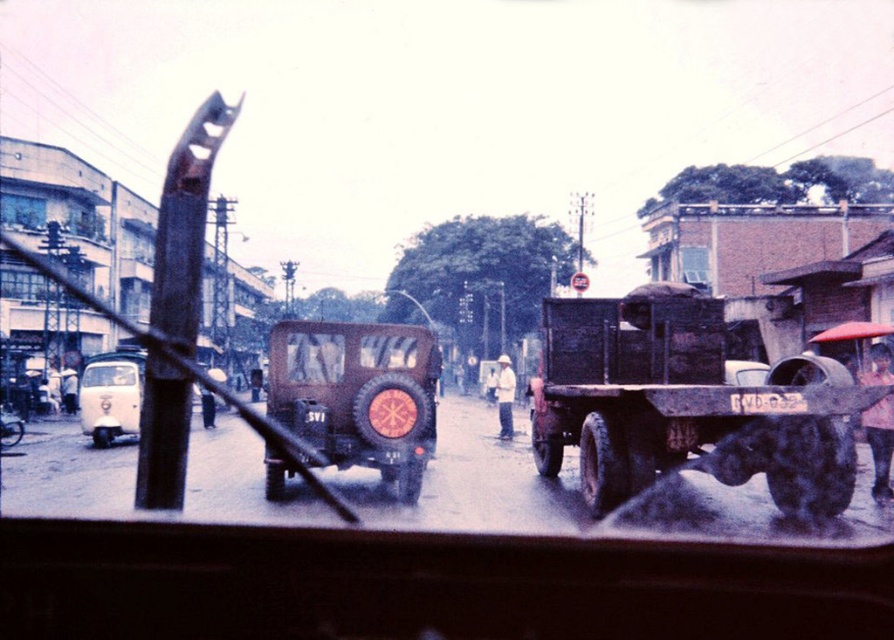
Is white matte van at left further to the viewer compared to white plastic license plate at center?

No, it is not.

Find the location of a particular element. white matte van at left is located at coordinates (111, 396).

Identify the location of white matte van at left. (111, 396).

Is matte brown military vehicle at center further to the viewer compared to white plastic license plate at center?

Yes, matte brown military vehicle at center is further from the viewer.

Is matte brown military vehicle at center closer to the viewer compared to white plastic license plate at center?

No, it is behind white plastic license plate at center.

This screenshot has height=640, width=894. In order to click on matte brown military vehicle at center in this screenshot , I will do pos(358,394).

Is rusty metal truck at right thinner than white matte van at left?

Yes, rusty metal truck at right is thinner than white matte van at left.

Does rusty metal truck at right have a lesser height compared to white matte van at left?

Indeed, rusty metal truck at right has a lesser height compared to white matte van at left.

Who is more forward, (612, 438) or (119, 372)?

Point (612, 438)

Locate an element on the screen. rusty metal truck at right is located at coordinates (682, 403).